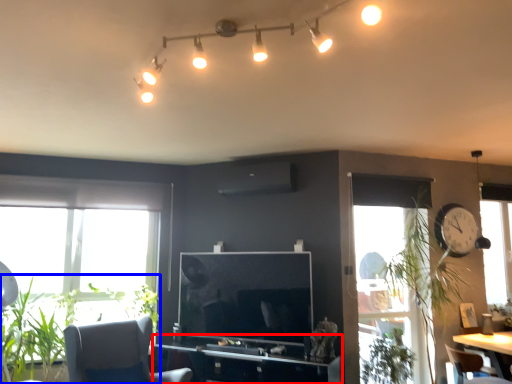
Question: Which of the following is the farthest to the observer, computer desk (highlighted by a red box) or plant (highlighted by a blue box)?

Choices:
 (A) computer desk
 (B) plant

Answer: (A)